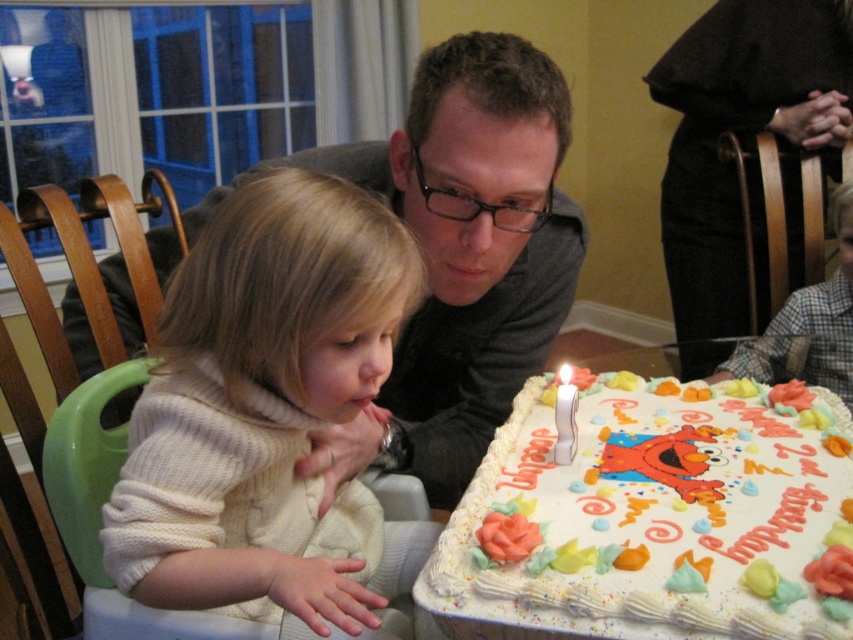
You are a photographer standing in the room and want to take a photo of the birthday scene. You notice a point at coordinates point (459, 256). What object is located at that point?

The point (459, 256) is on the matte gray shirt at center.

You are a photographer setting up for a birthday photo. You need to ensure both the white knit sweater at left and the matte gray shirt at upper center are visible in the frame. Given their sizes, which object should you prioritize positioning closer to the camera to ensure it doesn

The white knit sweater at left occupies less space than the matte gray shirt at upper center. To ensure both are visible, prioritize positioning the white knit sweater at left closer to the camera since it is smaller and might be harder to see from a distance.

You are a photographer who needs to capture a closeup of the white frosted cake at center. Based on the coordinates provided, where should you position your camera relative to the scene?

The white frosted cake at center is located at point (645, 520). To capture a closeup, position the camera directly facing this coordinate to ensure the cake is the main focus of the image.